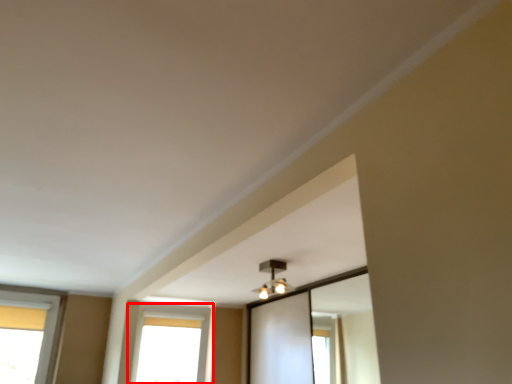
Question: From the image's perspective, where is window (annotated by the red box) located in relation to light fixture in the image?

Choices:
 (A) above
 (B) below

Answer: (B)